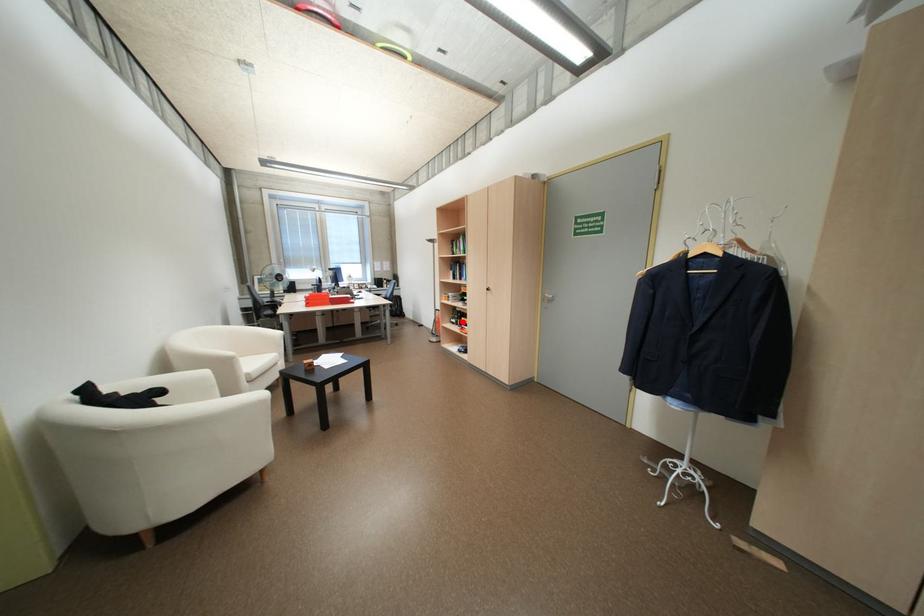
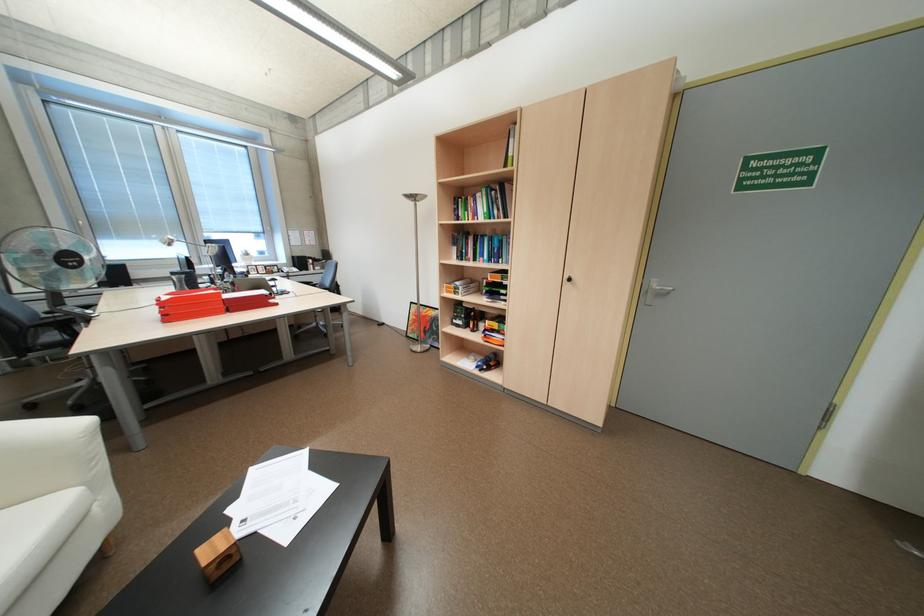
Find the pixel in the second image that matches the highlighted location in the first image.

(468, 325)